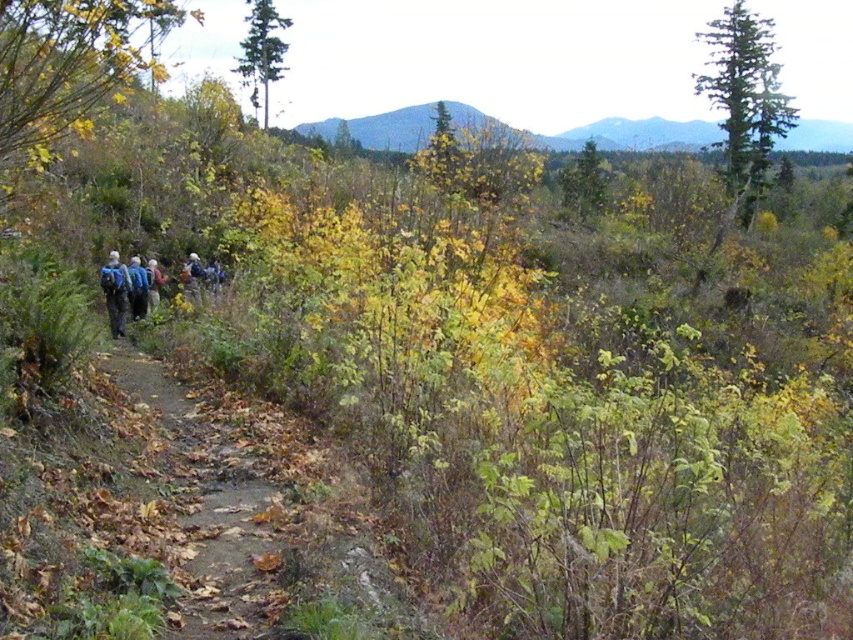
You are a hiker standing at the starting point of the brown dirt path at lower left. You want to reach the smooth gray mountain at upper center. Which direction should you head towards?

The smooth gray mountain at upper center is taller than the brown dirt path at lower left. You should head towards the upper center direction to reach the smooth gray mountain at upper center.

Looking at this image, you are a hiker standing at the starting point of your trail. You see the brown dirt path at lower left. Based on its position, which direction should you head to follow the path?

The brown dirt path at lower left is located at point (218, 500), so you should head towards the lower left direction to follow the path.